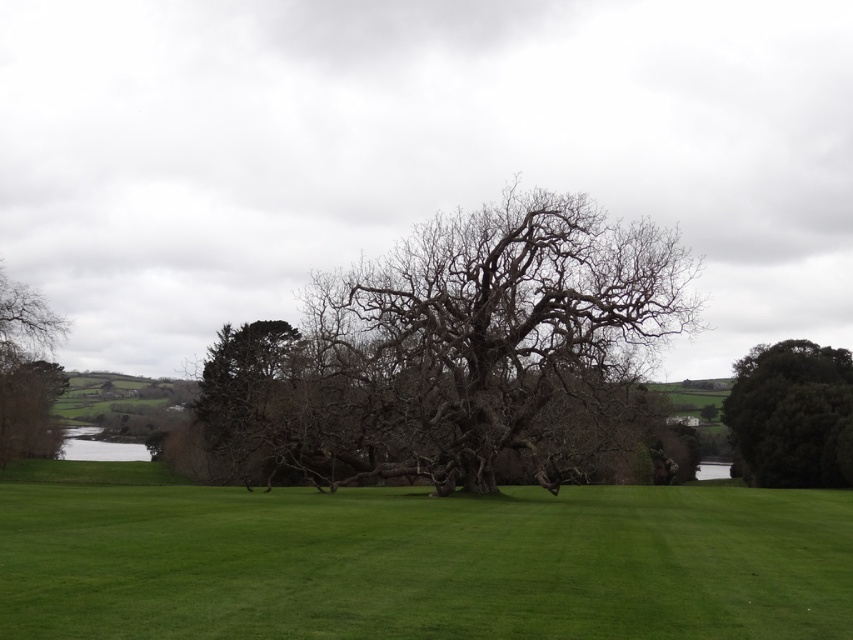
Does bare branches at center appear over bare branches at left?

Yes, bare branches at center is above bare branches at left.

This screenshot has height=640, width=853. I want to click on bare branches at center, so click(x=447, y=348).

The image size is (853, 640). I want to click on bare branches at center, so click(x=447, y=348).

Who is more distant from viewer, (746,422) or (51,317)?

The point (746,422) is behind.

Between point (801, 362) and point (53, 369), which one is positioned in front?

Point (53, 369) is more forward.

The image size is (853, 640). Describe the element at coordinates (792, 416) in the screenshot. I see `dark green leafy tree at right` at that location.

Locate an element on the screen. This screenshot has height=640, width=853. dark green leafy tree at right is located at coordinates click(x=792, y=416).

Does point (614, 397) come in front of point (795, 388)?

Yes, it is in front of point (795, 388).

Is bare branches at center closer to the viewer compared to dark green leafy tree at right?

Yes, bare branches at center is closer to the viewer.

Is point (508, 445) behind point (763, 428)?

No, it is not.

This screenshot has width=853, height=640. Find the location of `bare branches at center`. bare branches at center is located at coordinates (447, 348).